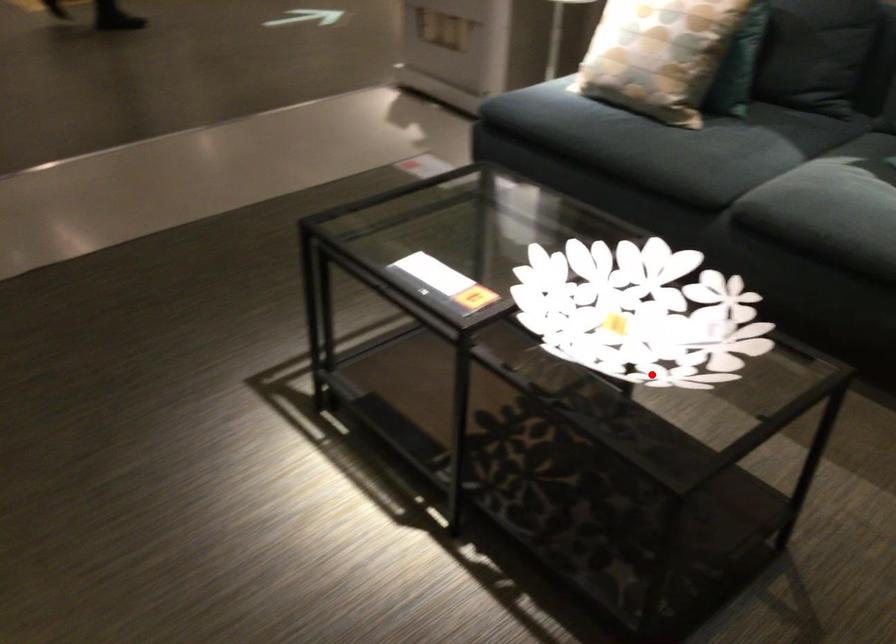
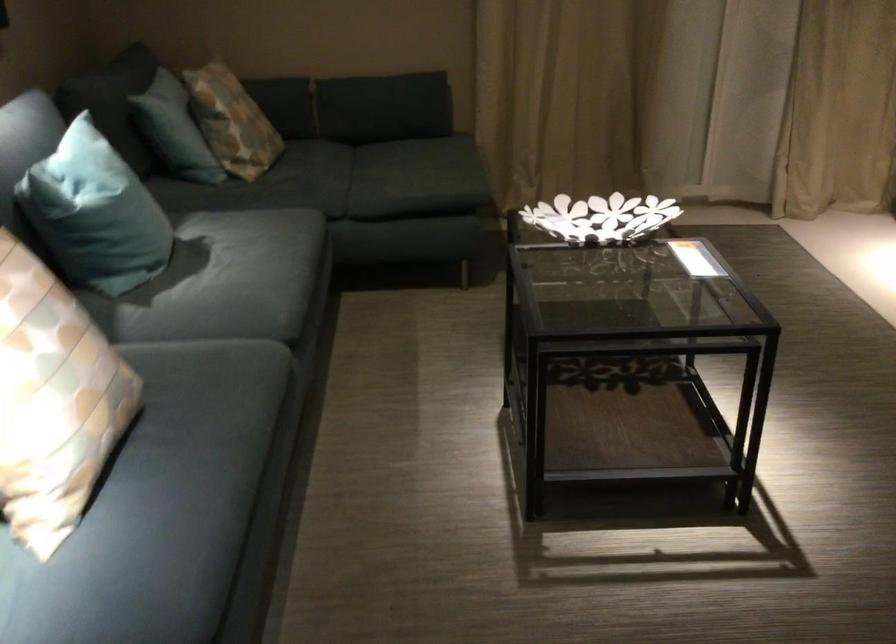
Where in the second image is the point corresponding to the highlighted location from the first image?

(600, 218)